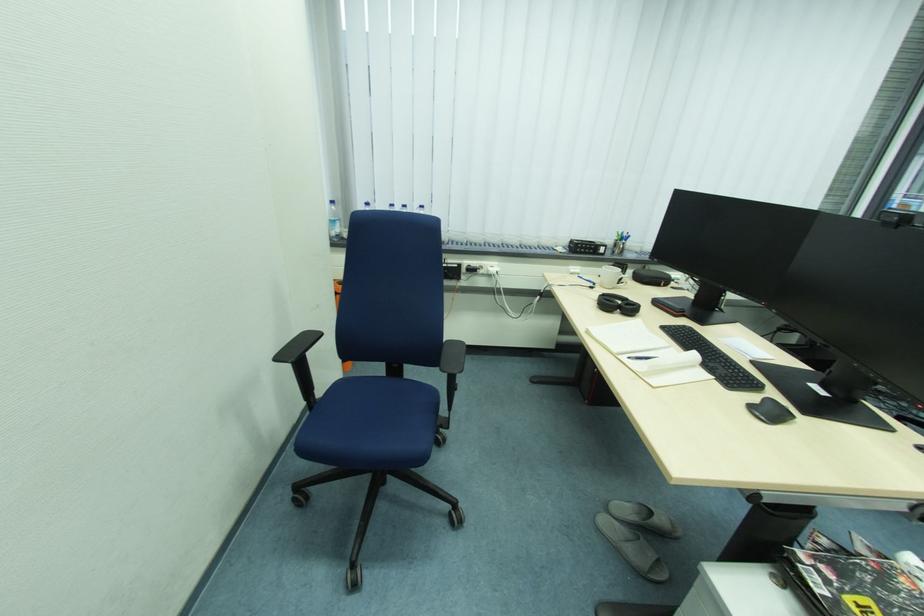
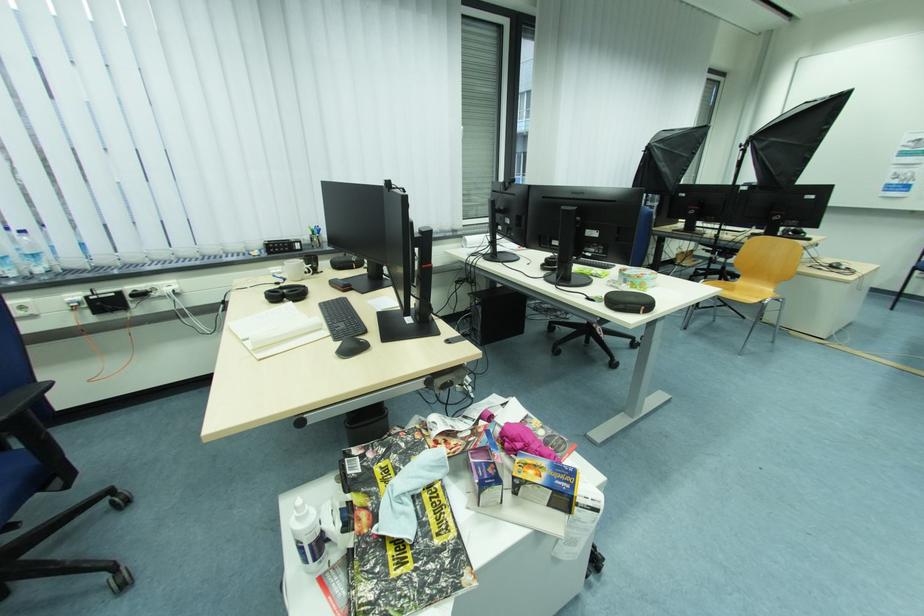
The point at (769,419) is marked in the first image. Where is the corresponding point in the second image?

(348, 357)